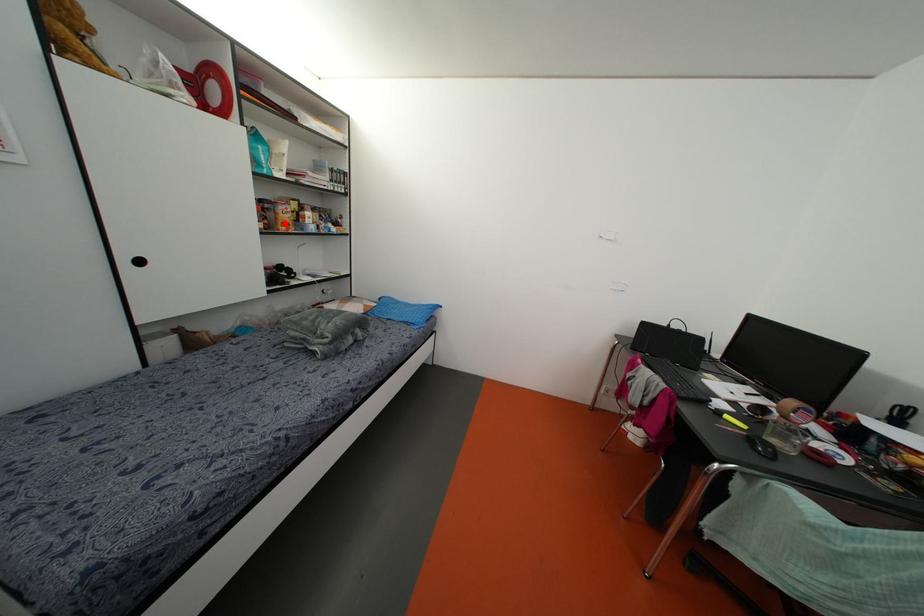
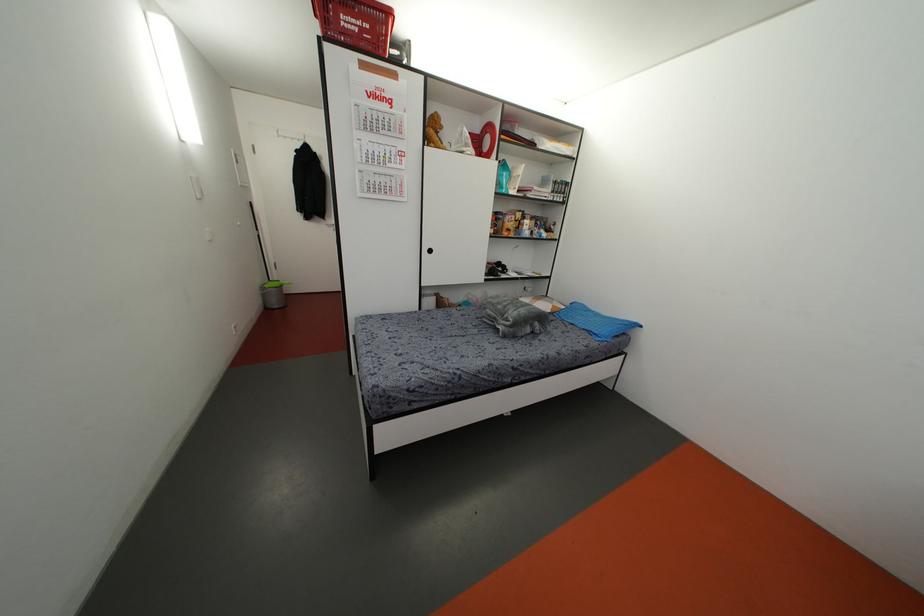
Find the pixel in the second image that matches the highlighted location in the first image.

(507, 229)